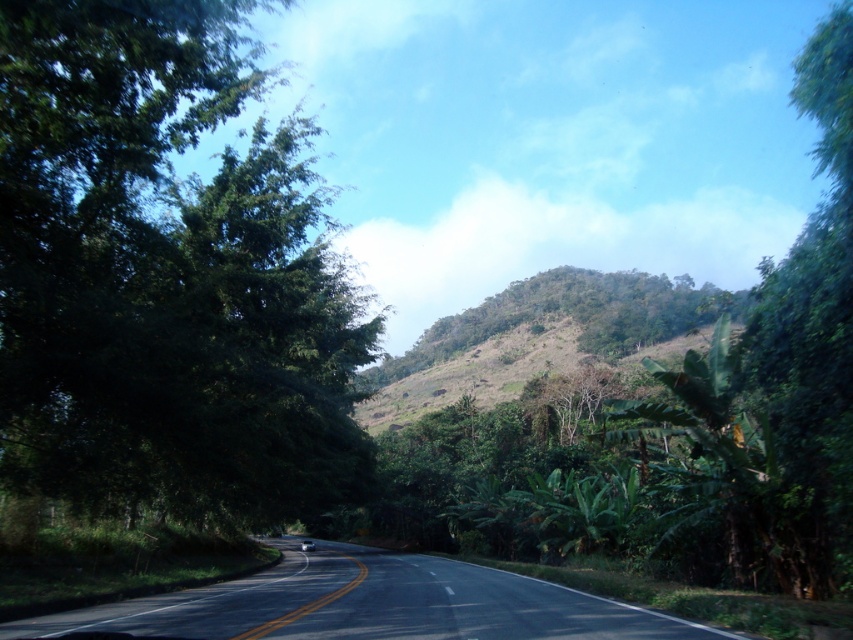
Is green leafy tree at left to the right of black asphalt road at center from the viewer's perspective?

Incorrect, green leafy tree at left is not on the right side of black asphalt road at center.

Is point (148, 307) closer to viewer compared to point (531, 588)?

Yes, point (148, 307) is closer to viewer.

Does point (84, 216) come closer to viewer compared to point (531, 632)?

No, it is not.

Where is `green leafy tree at left`? The width and height of the screenshot is (853, 640). green leafy tree at left is located at coordinates (164, 276).

Is the position of black asphalt road at center more distant than that of green grassy hillside at center?

No, it is not.

Is black asphalt road at center to the right of green grassy hillside at center from the viewer's perspective?

In fact, black asphalt road at center is to the left of green grassy hillside at center.

What do you see at coordinates (370, 604) in the screenshot? I see `black asphalt road at center` at bounding box center [370, 604].

Identify the location of black asphalt road at center. The width and height of the screenshot is (853, 640). 370,604.

Which is behind, point (801, 294) or point (389, 396)?

The point (389, 396) is behind.

The height and width of the screenshot is (640, 853). I want to click on green leafy tree at right, so click(805, 356).